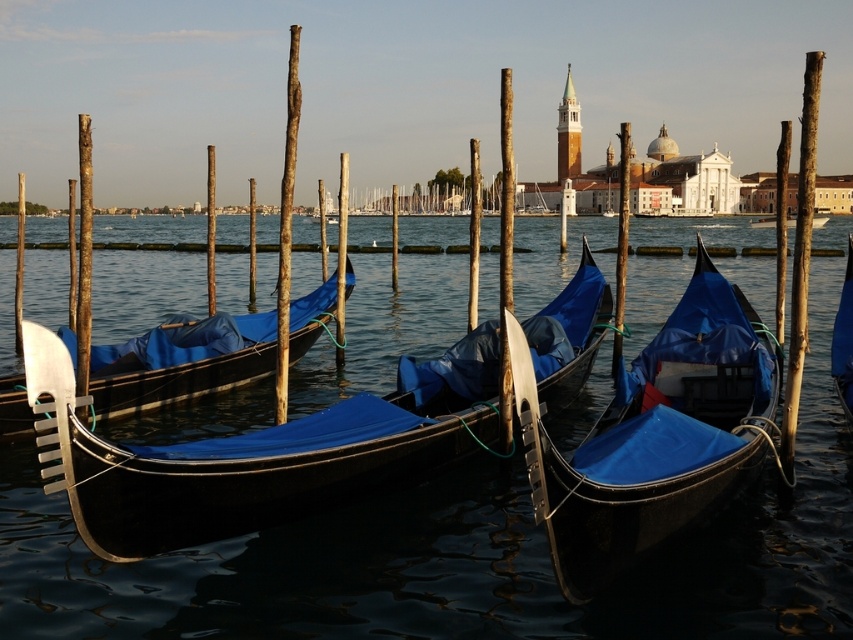
You are a tourist in Venice and want to rent a canoe to explore the canal. You see the shiny black canoe at center and the brown wood pole at center. Which object is bigger?

The shiny black canoe at center is larger than the brown wood pole at center.

You are standing at the edge of the canal in Venice and want to take a photo of the gondolas. If you walk 100 feet towards the point at coordinates point (282,380), will you be closer to the gondolas?

The distance of point (282,380) from camera is 233.96 feet. Walking 100 feet towards this point would bring you to 233.96 minus 100 equals 133.96 feet away from the point. Since the gondolas are located near the point, you would be closer to them.